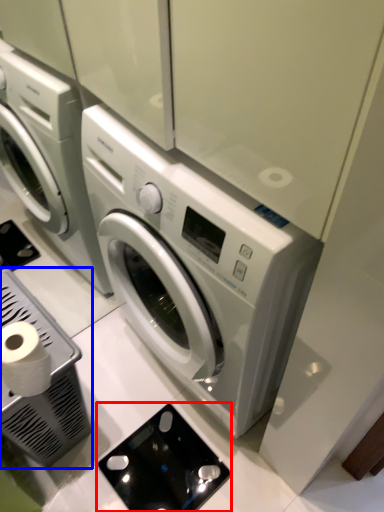
Question: Among these objects, which one is farthest to the camera, appliance (highlighted by a red box) or appliance (highlighted by a blue box)?

Choices:
 (A) appliance
 (B) appliance

Answer: (A)